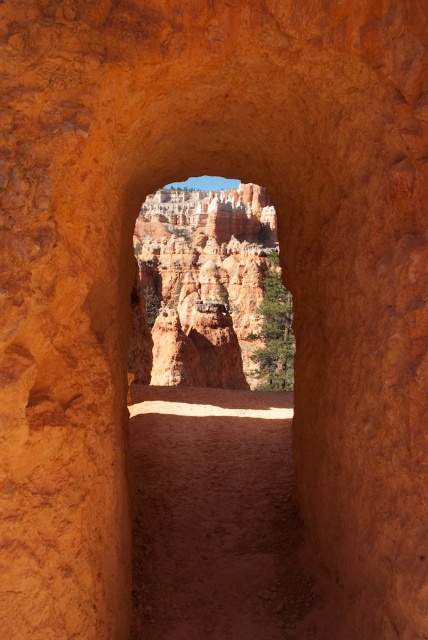
You are a hiker standing at the base of the rock formation looking through the natural archway. You notice two points marked on your map. The first point is at coordinate (157, 449) and the second is at (291, 368). Which point is closer to you as you stand at the base?

Point (157, 449) is in front of point (291, 368), so the first point is closer to you.